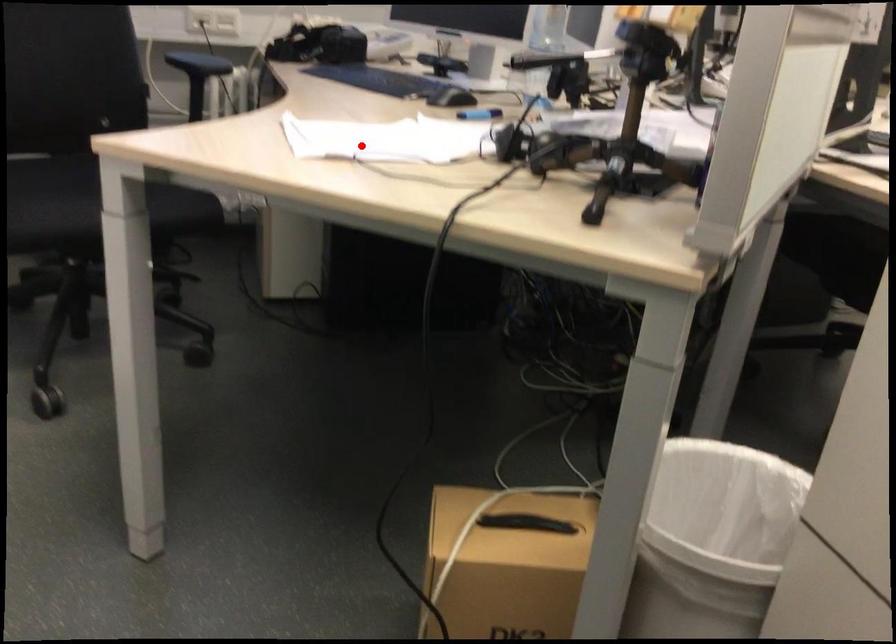
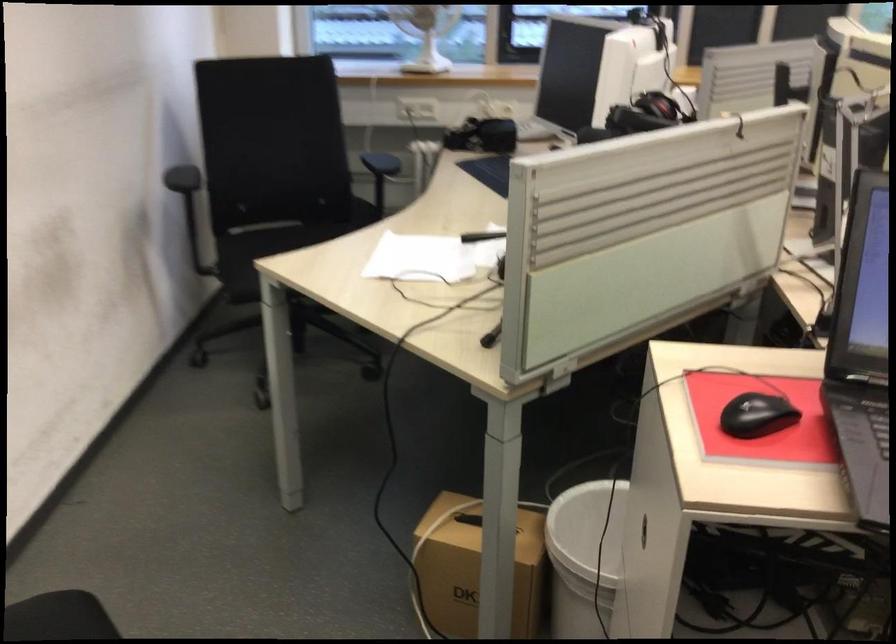
Where in the second image is the point corresponding to the highlighted location from the first image?

(419, 259)